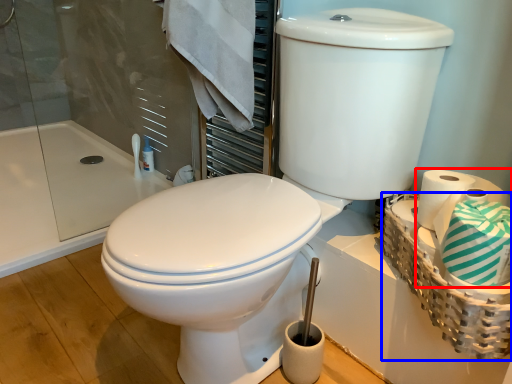
Question: Which object appears farthest to the camera in this image, toilet paper (highlighted by a red box) or basket (highlighted by a blue box)?

Choices:
 (A) toilet paper
 (B) basket

Answer: (B)